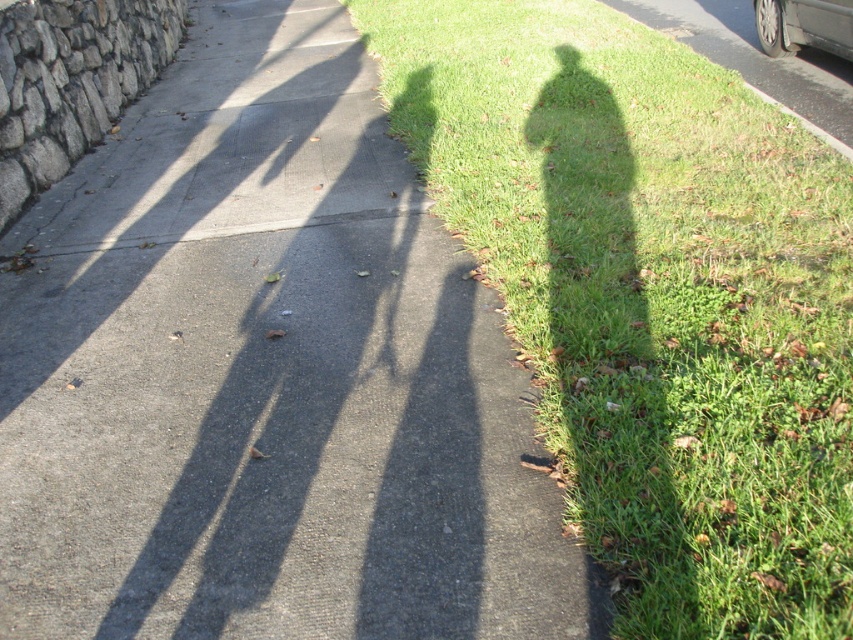
You are standing on the gray asphalt sidewalk at center and want to move to the grassy area on the right. Is the metallic gray car at upper right blocking your path?

The gray asphalt sidewalk at center is below the metallic gray car at upper right, so the car is positioned above your current location. This means the metallic gray car at upper right is blocking your path to the grassy area on the right.